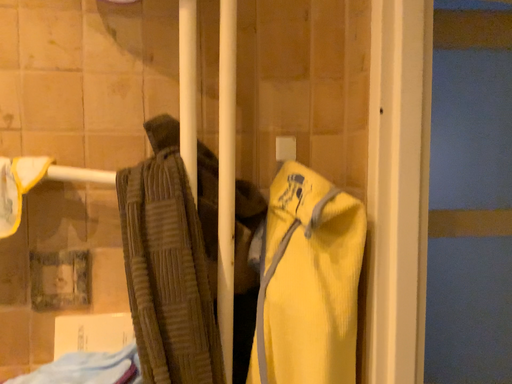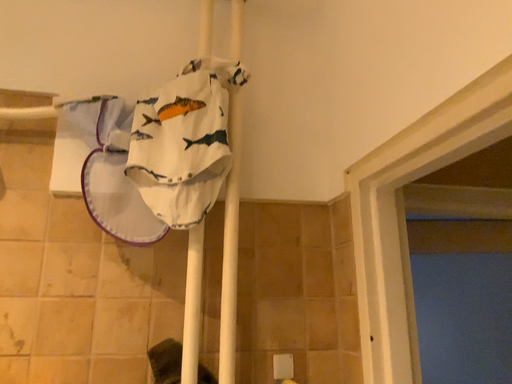
Question: Which way did the camera rotate in the video?

Choices:
 (A) rotated downward
 (B) rotated upward

Answer: (B)